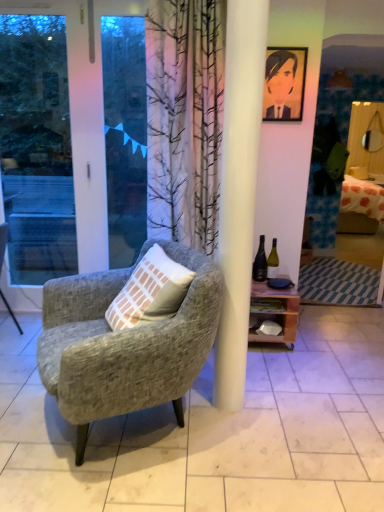
Locate an element on the screen. This screenshot has height=512, width=384. unoccupied area in front of green glass bottle at center-right, which is the second bottle from right to left is located at coordinates (259, 288).